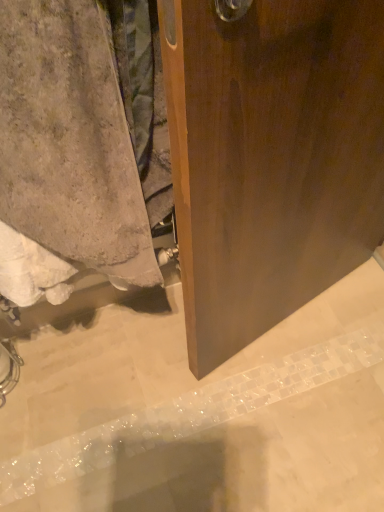
What is the approximate height of beige textured towel at lower left?

beige textured towel at lower left is 24.65 inches in height.

Image resolution: width=384 pixels, height=512 pixels. Describe the element at coordinates (69, 140) in the screenshot. I see `beige textured towel at lower left` at that location.

Where is `beige textured towel at lower left`? The height and width of the screenshot is (512, 384). beige textured towel at lower left is located at coordinates (69, 140).

Where is `gray concrete at lower left`? gray concrete at lower left is located at coordinates (203, 414).

Describe the element at coordinates (203, 414) in the screenshot. I see `gray concrete at lower left` at that location.

Locate an element on the screen. The width and height of the screenshot is (384, 512). beige textured towel at lower left is located at coordinates pyautogui.click(x=69, y=140).

Between beige textured towel at lower left and gray concrete at lower left, which one appears on the right side from the viewer's perspective?

gray concrete at lower left is more to the right.

Considering the relative positions of beige textured towel at lower left and gray concrete at lower left in the image provided, is beige textured towel at lower left in front of gray concrete at lower left?

Yes, it is.

Considering the positions of points (99, 95) and (29, 359), is point (99, 95) closer to camera compared to point (29, 359)?

Yes, it is.

From the image's perspective, which object appears higher, beige textured towel at lower left or gray concrete at lower left?

beige textured towel at lower left is shown above in the image.

From a real-world perspective, is beige textured towel at lower left physically above gray concrete at lower left?

Yes, from a real-world perspective, beige textured towel at lower left is on top of gray concrete at lower left.

Between beige textured towel at lower left and gray concrete at lower left, which one has larger width?

Wider between the two is gray concrete at lower left.

Considering the sizes of objects beige textured towel at lower left and gray concrete at lower left in the image provided, who is shorter, beige textured towel at lower left or gray concrete at lower left?

Standing shorter between the two is gray concrete at lower left.

Between beige textured towel at lower left and gray concrete at lower left, which one has smaller size?

gray concrete at lower left is smaller.

Do you think beige textured towel at lower left is within gray concrete at lower left, or outside of it?

beige textured towel at lower left exists outside the volume of gray concrete at lower left.

Is there a large distance between beige textured towel at lower left and gray concrete at lower left?

No.

Is beige textured towel at lower left looking in the opposite direction of gray concrete at lower left?

beige textured towel at lower left is not turned away from gray concrete at lower left.

Image resolution: width=384 pixels, height=512 pixels. In the image, there is a beige textured towel at lower left. In order to click on concrete below it (from the image's perspective) in this screenshot , I will do `click(203, 414)`.

Considering the positions of objects gray concrete at lower left and beige textured towel at lower left in the image provided, who is more to the right, gray concrete at lower left or beige textured towel at lower left?

Positioned to the right is gray concrete at lower left.

Is the depth of gray concrete at lower left greater than that of beige textured towel at lower left?

Yes, it is behind beige textured towel at lower left.

Is point (50, 366) closer or farther from the camera than point (84, 17)?

Point (50, 366).

From the image's perspective, is gray concrete at lower left positioned above or below beige textured towel at lower left?

Clearly, from the image's perspective, gray concrete at lower left is below beige textured towel at lower left.

From a real-world perspective, does gray concrete at lower left stand above beige textured towel at lower left?

No, from a real-world perspective, gray concrete at lower left is not on top of beige textured towel at lower left.

Which of these two, gray concrete at lower left or beige textured towel at lower left, is wider?

With larger width is gray concrete at lower left.

In terms of height, does gray concrete at lower left look taller or shorter compared to beige textured towel at lower left?

Clearly, gray concrete at lower left is shorter compared to beige textured towel at lower left.

From the picture: Between gray concrete at lower left and beige textured towel at lower left, which one has smaller size?

gray concrete at lower left.

Is gray concrete at lower left spatially inside beige textured towel at lower left, or outside of it?

gray concrete at lower left is outside beige textured towel at lower left.

Is gray concrete at lower left not near beige textured towel at lower left?

No.

Could you tell me if gray concrete at lower left is turned towards beige textured towel at lower left?

No.

How far apart are gray concrete at lower left and beige textured towel at lower left?

23.82 inches.

Where is `concrete located below the beige textured towel at lower left (from the image's perspective)`? The height and width of the screenshot is (512, 384). concrete located below the beige textured towel at lower left (from the image's perspective) is located at coordinates (203, 414).

Find the location of a particular element. The width and height of the screenshot is (384, 512). concrete below the beige textured towel at lower left (from the image's perspective) is located at coordinates (203, 414).

You are a GUI agent. You are given a task and a screenshot of the screen. Output one action in this format:
    pyautogui.click(x=<x>, y=<y>)
    Task: Click on the towel that appears on the left of gray concrete at lower left
    The width and height of the screenshot is (384, 512).
    Given the screenshot: What is the action you would take?
    pyautogui.click(x=69, y=140)